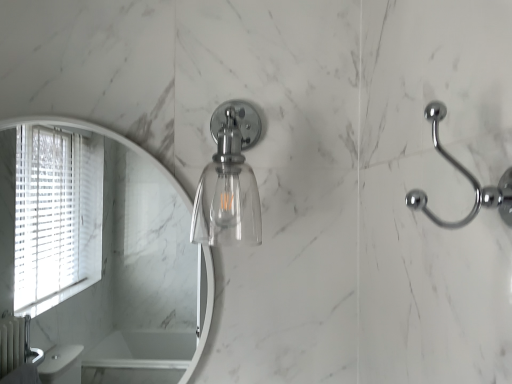
Question: From their relative heights in the image, would you say polished chrome hook at right is taller or shorter than clear glass light fixture at center?

Choices:
 (A) short
 (B) tall

Answer: (A)

Question: From the image's perspective, is polished chrome hook at right located above or below clear glass light fixture at center?

Choices:
 (A) below
 (B) above

Answer: (A)

Question: Looking at their shapes, would you say polished chrome hook at right is wider or thinner than clear glass light fixture at center?

Choices:
 (A) wide
 (B) thin

Answer: (B)

Question: Is clear glass light fixture at center taller or shorter than polished chrome hook at right?

Choices:
 (A) tall
 (B) short

Answer: (A)

Question: In terms of size, does clear glass light fixture at center appear bigger or smaller than polished chrome hook at right?

Choices:
 (A) big
 (B) small

Answer: (A)

Question: Is point (225, 225) positioned closer to the camera than point (436, 142)?

Choices:
 (A) farther
 (B) closer

Answer: (A)

Question: From the image's perspective, is clear glass light fixture at center above or below polished chrome hook at right?

Choices:
 (A) above
 (B) below

Answer: (A)